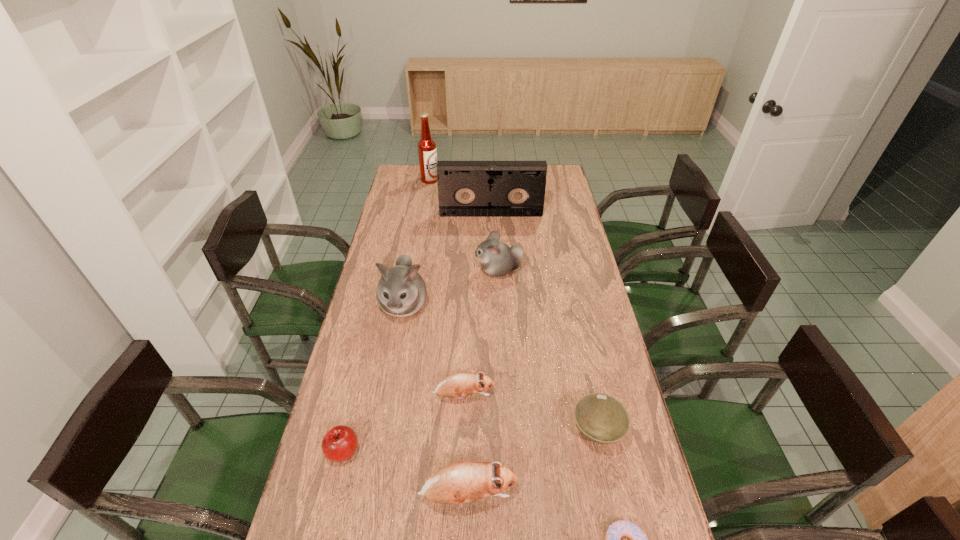
What are the coordinates of `bowl that is positioned at the right edge` in the screenshot? It's located at (601, 418).

Where is `object that is at the far left corner`? object that is at the far left corner is located at coordinates (427, 153).

I want to click on vacant area at the left edge of the desktop, so click(331, 533).

At what (x,y) coordinates should I click in order to perform the action: click on free space at the right edge. Please return your answer as a coordinate pair (x, y). Image resolution: width=960 pixels, height=540 pixels. Looking at the image, I should click on (600, 356).

Where is `vacant space at the far left corner of the desktop`? The width and height of the screenshot is (960, 540). vacant space at the far left corner of the desktop is located at coordinates (396, 184).

In the image, there is a desktop. At what (x,y) coordinates should I click in order to perform the action: click on vacant space at the far right corner. Please return your answer as a coordinate pair (x, y). The width and height of the screenshot is (960, 540). Looking at the image, I should click on (553, 183).

This screenshot has height=540, width=960. What are the coordinates of `vacant point located between the nearest hamster and the pink apple` in the screenshot? It's located at (406, 474).

Locate an element on the screen. This screenshot has height=540, width=960. free space between the alcohol and the fifth shortest object is located at coordinates (449, 338).

Where is `vacant space in between the second nearest hamster and the videotape`? The width and height of the screenshot is (960, 540). vacant space in between the second nearest hamster and the videotape is located at coordinates (477, 305).

Where is `free area in between the nearer white hamster and the smaller brown hamster`? The image size is (960, 540). free area in between the nearer white hamster and the smaller brown hamster is located at coordinates (434, 350).